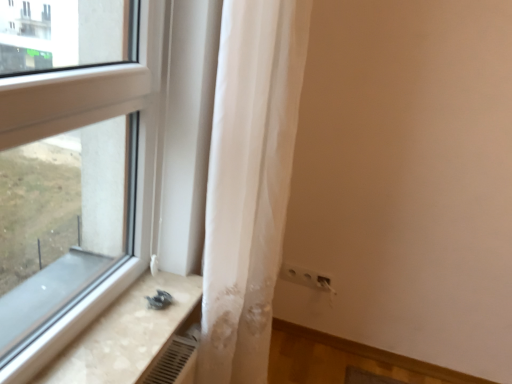
Question: From the image's perspective, would you say beige marble counter top at lower left is positioned over white sheer curtain at center?

Choices:
 (A) no
 (B) yes

Answer: (A)

Question: Is beige marble counter top at lower left turned away from white sheer curtain at center?

Choices:
 (A) no
 (B) yes

Answer: (A)

Question: Is beige marble counter top at lower left next to white sheer curtain at center?

Choices:
 (A) yes
 (B) no

Answer: (B)

Question: Does beige marble counter top at lower left have a larger size compared to white sheer curtain at center?

Choices:
 (A) yes
 (B) no

Answer: (B)

Question: Is white sheer curtain at center surrounded by beige marble counter top at lower left?

Choices:
 (A) yes
 (B) no

Answer: (B)

Question: Considering the relative positions of beige marble counter top at lower left and white sheer curtain at center in the image provided, is beige marble counter top at lower left to the right of white sheer curtain at center from the viewer's perspective?

Choices:
 (A) no
 (B) yes

Answer: (A)

Question: From a real-world perspective, is beige marble counter top at lower left located beneath white plastic electric outlet at lower right?

Choices:
 (A) no
 (B) yes

Answer: (A)

Question: From a real-world perspective, is beige marble counter top at lower left located higher than white plastic electric outlet at lower right?

Choices:
 (A) yes
 (B) no

Answer: (A)

Question: Is beige marble counter top at lower left facing away from white plastic electric outlet at lower right?

Choices:
 (A) no
 (B) yes

Answer: (A)

Question: Does beige marble counter top at lower left have a larger size compared to white plastic electric outlet at lower right?

Choices:
 (A) yes
 (B) no

Answer: (A)

Question: Does beige marble counter top at lower left turn towards white plastic electric outlet at lower right?

Choices:
 (A) yes
 (B) no

Answer: (B)

Question: Does beige marble counter top at lower left touch white plastic electric outlet at lower right?

Choices:
 (A) yes
 (B) no

Answer: (B)

Question: Is white sheer curtain at center wider than beige marble counter top at lower left?

Choices:
 (A) no
 (B) yes

Answer: (A)